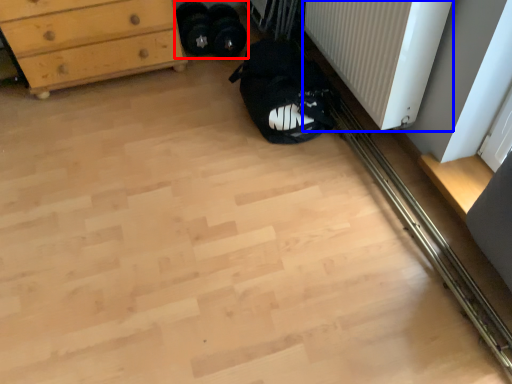
Question: Among these objects, which one is nearest to the camera, footwear (highlighted by a red box) or radiator (highlighted by a blue box)?

Choices:
 (A) footwear
 (B) radiator

Answer: (B)